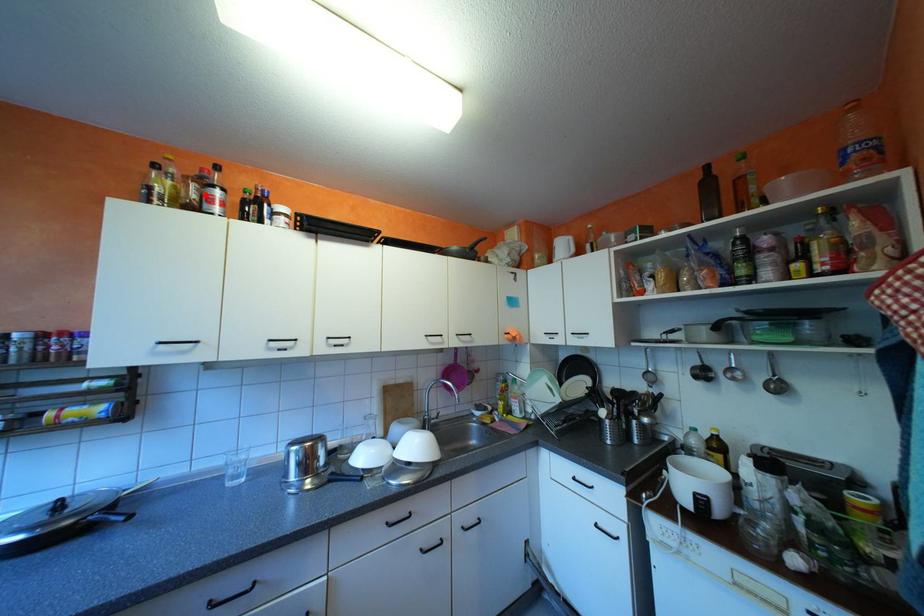
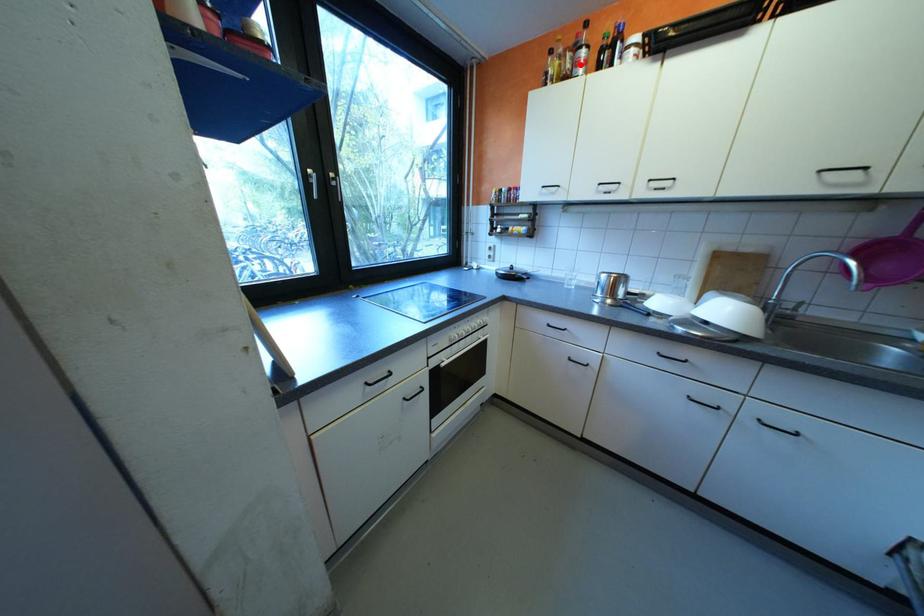
I am providing you with two images of the same scene from different viewpoints. A red point is marked on the first image and another point is marked on the second image. Is the marked point in image1 the same physical position as the marked point in image2?

Yes